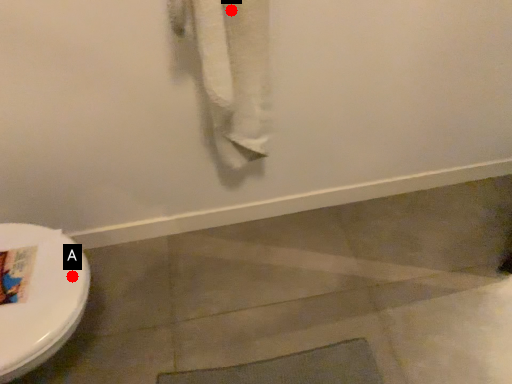
Question: Two points are circled on the image, labeled by A and B beside each circle. Which point is closer to the camera?

Choices:
 (A) A is closer
 (B) B is closer

Answer: (B)